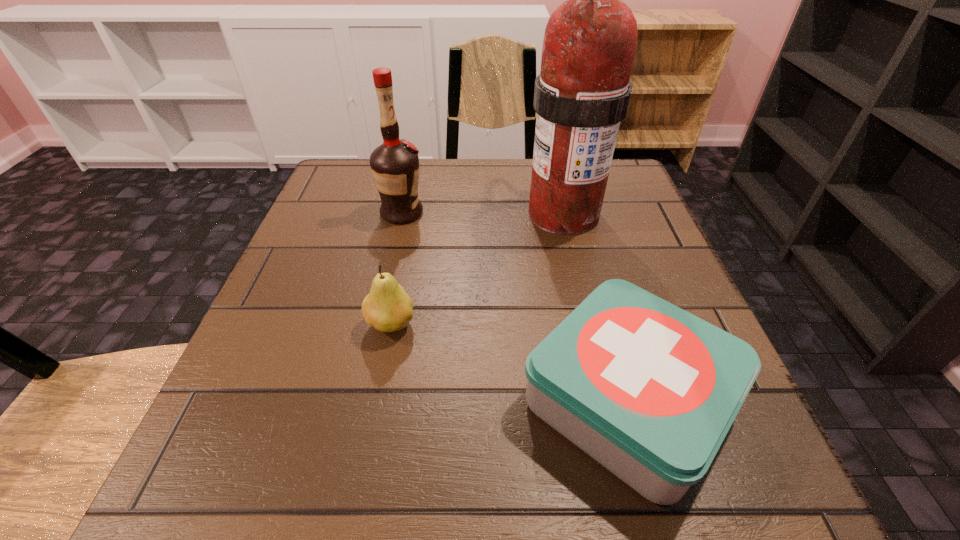
Where is `free location that satisfies the following two spatial constraints: 1. on the back side of the first-aid kit; 2. on the front and back of the liquor`? This screenshot has width=960, height=540. free location that satisfies the following two spatial constraints: 1. on the back side of the first-aid kit; 2. on the front and back of the liquor is located at coordinates (576, 213).

Where is `free space that satisfies the following two spatial constraints: 1. on the front and back of the second tallest object; 2. on the left side of the first-aid kit`? The image size is (960, 540). free space that satisfies the following two spatial constraints: 1. on the front and back of the second tallest object; 2. on the left side of the first-aid kit is located at coordinates (360, 400).

Locate an element on the screen. Image resolution: width=960 pixels, height=540 pixels. free space that satisfies the following two spatial constraints: 1. on the front and back of the pear; 2. on the right side of the liquor is located at coordinates (377, 324).

Image resolution: width=960 pixels, height=540 pixels. What are the coordinates of `free space that satisfies the following two spatial constraints: 1. at the nozzle of the fire extinguisher; 2. on the front and back of the third shortest object` in the screenshot? It's located at tap(564, 213).

Identify the location of free location that satisfies the following two spatial constraints: 1. on the front and back of the liquor; 2. on the back side of the first-aid kit. (360, 400).

You are a GUI agent. You are given a task and a screenshot of the screen. Output one action in this format:
    pyautogui.click(x=<x>, y=<y>)
    Task: Click on the vacant point that satisfies the following two spatial constraints: 1. on the front and back of the liquor; 2. on the left side of the shortest object
    The height and width of the screenshot is (540, 960).
    Given the screenshot: What is the action you would take?
    pyautogui.click(x=360, y=400)